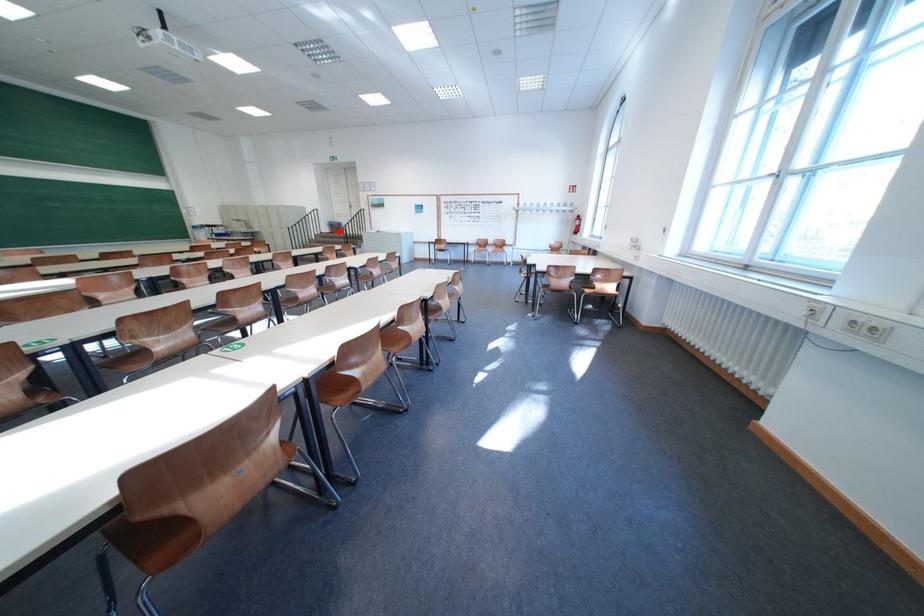
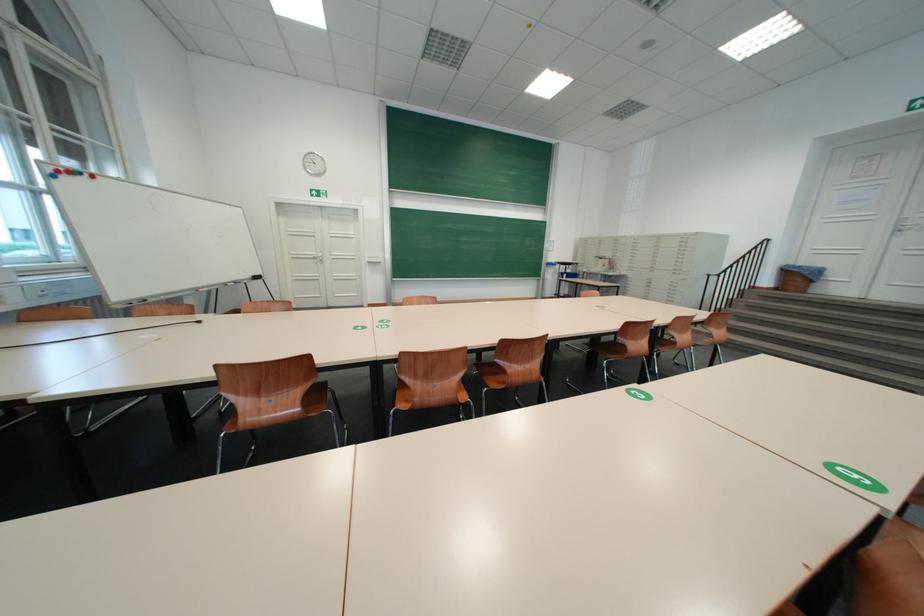
Question: I am providing you with two images of the same scene from different viewpoints. Image1 has a red point marked. In image2, the corresponding 3D location appears at what relative position? Reply with the corresponding letter.

Choices:
 (A) Closer
 (B) Farther

Answer: (B)